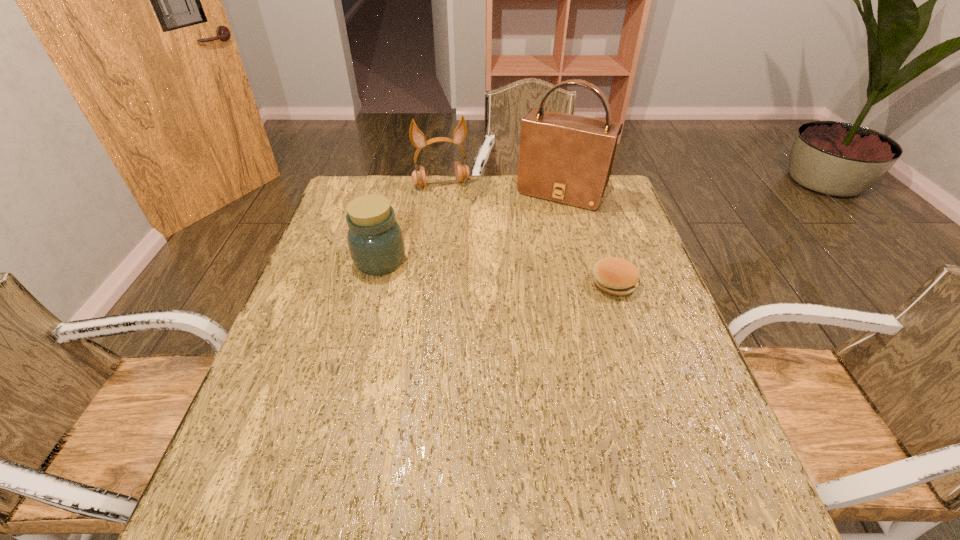
Find the location of `jar`. jar is located at coordinates (375, 240).

Locate an element on the screen. patty is located at coordinates (615, 276).

Locate an element on the screen. The width and height of the screenshot is (960, 540). the second tallest object is located at coordinates (417, 138).

Identify the location of the tallest object. (564, 158).

This screenshot has height=540, width=960. In order to click on free spot located on the back of the jar in this screenshot , I will do `click(398, 186)`.

Find the location of `vacant space situated 0.320m on the front of the patty`. vacant space situated 0.320m on the front of the patty is located at coordinates (657, 417).

Identify the location of free space located on the front-facing side of the second tallest object. (473, 269).

You are a GUI agent. You are given a task and a screenshot of the screen. Output one action in this format:
    pyautogui.click(x=<x>, y=<y>)
    Task: Click on the blank space located on the front-facing side of the second tallest object
    This screenshot has width=960, height=540.
    Given the screenshot: What is the action you would take?
    pyautogui.click(x=455, y=214)

Find the location of a particular element. vacant area situated on the front-facing side of the second tallest object is located at coordinates (462, 233).

Image resolution: width=960 pixels, height=540 pixels. Identify the location of blank space located 0.340m on the front flap of the tallest object. (508, 279).